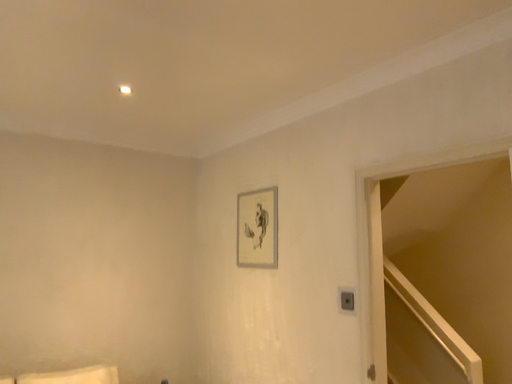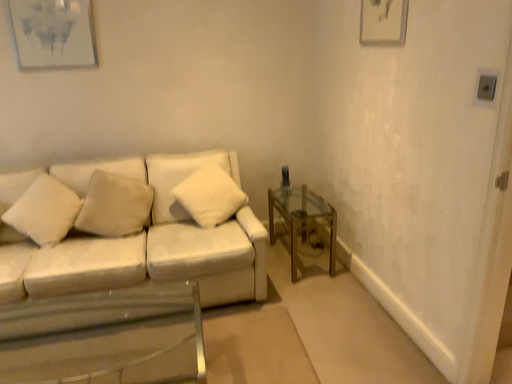
Question: How did the camera likely rotate when shooting the video?

Choices:
 (A) rotated right
 (B) rotated left

Answer: (B)